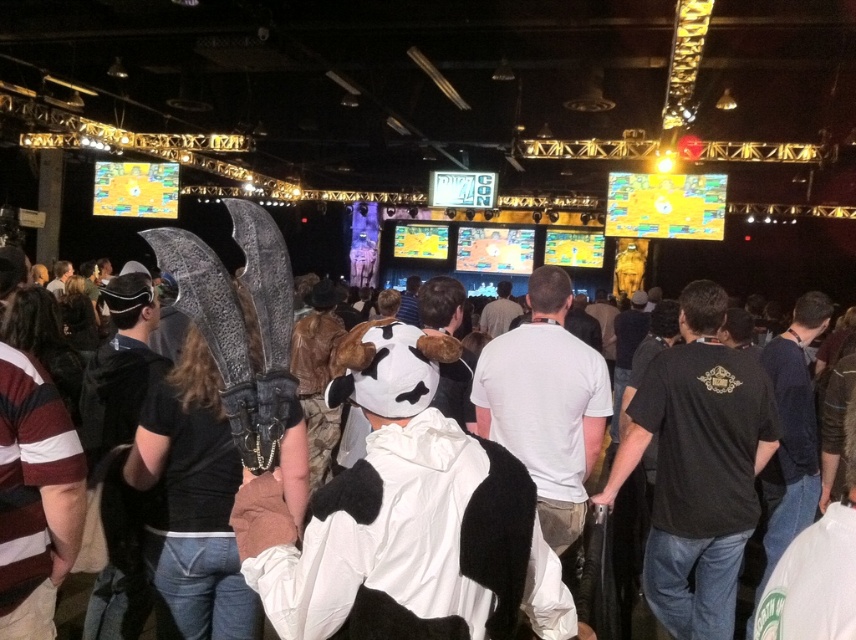
Question: Among these points, which one is nearest to the camera?

Choices:
 (A) (405, 592)
 (B) (483, 412)

Answer: (A)

Question: In this image, where is white plush cow at center located relative to white fur coat at center?

Choices:
 (A) right
 (B) left

Answer: (A)

Question: Which of the following is the closest to the observer?

Choices:
 (A) (24, 269)
 (B) (239, 508)

Answer: (B)

Question: Does white plush cow at center appear on the right side of white fur coat at center?

Choices:
 (A) yes
 (B) no

Answer: (A)

Question: Which of the following is the farthest from the observer?

Choices:
 (A) white plush cow at center
 (B) white fur coat at center

Answer: (B)

Question: Can you confirm if white plush cow at center is positioned to the left of white fur coat at center?

Choices:
 (A) no
 (B) yes

Answer: (A)